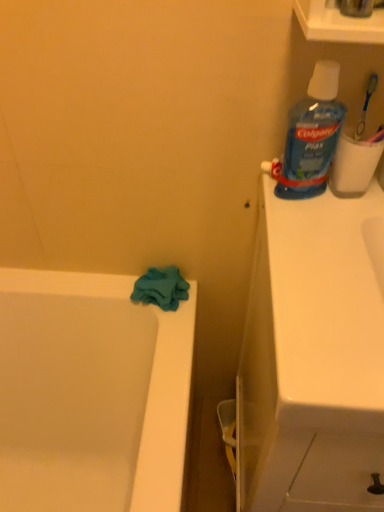
Question: Is white glossy sink at upper right thinner than blue plastic toothbrush at upper right?

Choices:
 (A) no
 (B) yes

Answer: (A)

Question: Is white glossy sink at upper right smaller than blue plastic toothbrush at upper right?

Choices:
 (A) yes
 (B) no

Answer: (B)

Question: Is the depth of white glossy sink at upper right less than that of blue plastic toothbrush at upper right?

Choices:
 (A) no
 (B) yes

Answer: (B)

Question: Is white glossy sink at upper right completely or partially outside of blue plastic toothbrush at upper right?

Choices:
 (A) yes
 (B) no

Answer: (A)

Question: Can you confirm if white glossy sink at upper right is taller than blue plastic toothbrush at upper right?

Choices:
 (A) no
 (B) yes

Answer: (B)

Question: From the image's perspective, is white matte toilet paper at upper right above or below teal soft cloth at lower left?

Choices:
 (A) below
 (B) above

Answer: (B)

Question: Is point (349, 136) positioned closer to the camera than point (155, 273)?

Choices:
 (A) farther
 (B) closer

Answer: (B)

Question: Is white matte toilet paper at upper right spatially inside teal soft cloth at lower left, or outside of it?

Choices:
 (A) outside
 (B) inside

Answer: (A)

Question: Would you say white matte toilet paper at upper right is to the left or to the right of teal soft cloth at lower left in the picture?

Choices:
 (A) left
 (B) right

Answer: (B)

Question: Is blue translucent plastic mouthwash at upper right taller or shorter than white glossy sink at upper right?

Choices:
 (A) tall
 (B) short

Answer: (B)

Question: Is blue translucent plastic mouthwash at upper right in front of or behind white glossy sink at upper right in the image?

Choices:
 (A) front
 (B) behind

Answer: (B)

Question: Is blue translucent plastic mouthwash at upper right bigger or smaller than white glossy sink at upper right?

Choices:
 (A) small
 (B) big

Answer: (A)

Question: From the image's perspective, is blue translucent plastic mouthwash at upper right positioned above or below white glossy sink at upper right?

Choices:
 (A) below
 (B) above

Answer: (B)

Question: From the image's perspective, is blue plastic toothbrush at upper right above or below teal soft cloth at lower left?

Choices:
 (A) above
 (B) below

Answer: (A)

Question: In the image, is blue plastic toothbrush at upper right on the left side or the right side of teal soft cloth at lower left?

Choices:
 (A) right
 (B) left

Answer: (A)